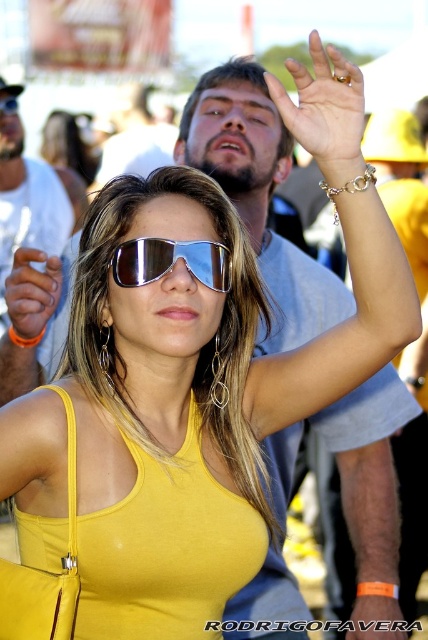
Between matte white shirt at upper center and sunglasses at center, which one has less height?

Standing shorter between the two is sunglasses at center.

Can you confirm if matte white shirt at upper center is bigger than sunglasses at center?

Indeed, matte white shirt at upper center has a larger size compared to sunglasses at center.

Describe the element at coordinates (27, 202) in the screenshot. This screenshot has height=640, width=428. I see `matte white shirt at upper center` at that location.

The width and height of the screenshot is (428, 640). I want to click on matte white shirt at upper center, so pos(27,202).

Can you confirm if matte white shirt at upper center is wider than matte black sunglasses at upper center?

Correct, the width of matte white shirt at upper center exceeds that of matte black sunglasses at upper center.

Who is taller, matte white shirt at upper center or matte black sunglasses at upper center?

matte white shirt at upper center is taller.

Between point (36, 196) and point (8, 97), which one is positioned behind?

The point (36, 196) is behind.

The image size is (428, 640). What are the coordinates of `matte white shirt at upper center` in the screenshot? It's located at (27, 202).

Does sunglasses at center come in front of matte black sunglasses at upper center?

Yes, sunglasses at center is closer to the viewer.

Is point (115, 262) positioned in front of point (15, 100)?

That is True.

Who is more distant from viewer, (155, 240) or (11, 109)?

Positioned behind is point (11, 109).

Locate an element on the screen. sunglasses at center is located at coordinates (171, 260).